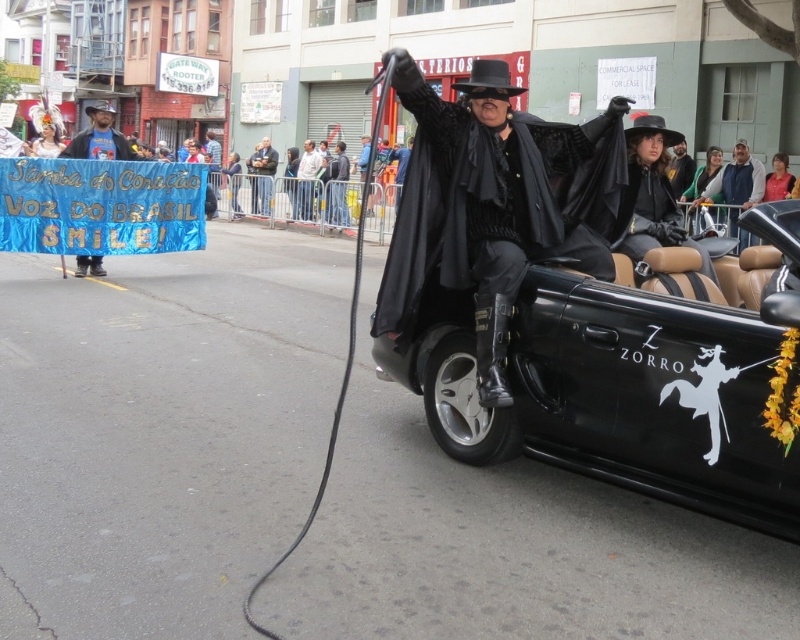
Who is more forward, [618,472] or [100,122]?

Point [618,472]

Locate an element on the screen. black leather convertible at center is located at coordinates (621, 388).

Does black matte cloak at center have a lesser width compared to pink fabric shirt at upper right?

In fact, black matte cloak at center might be wider than pink fabric shirt at upper right.

Who is taller, black matte cloak at center or pink fabric shirt at upper right?

Standing taller between the two is black matte cloak at center.

Find the location of a particular element. The width and height of the screenshot is (800, 640). black matte cloak at center is located at coordinates (496, 198).

Locate an element on the screen. The height and width of the screenshot is (640, 800). black matte cloak at center is located at coordinates (496, 198).

Between black leather convertible at center and black matte cloak at center, which one is positioned higher?

black matte cloak at center is above.

Find the location of a particular element. Image resolution: width=800 pixels, height=640 pixels. black leather convertible at center is located at coordinates (621, 388).

Image resolution: width=800 pixels, height=640 pixels. Find the location of `black leather convertible at center`. black leather convertible at center is located at coordinates (621, 388).